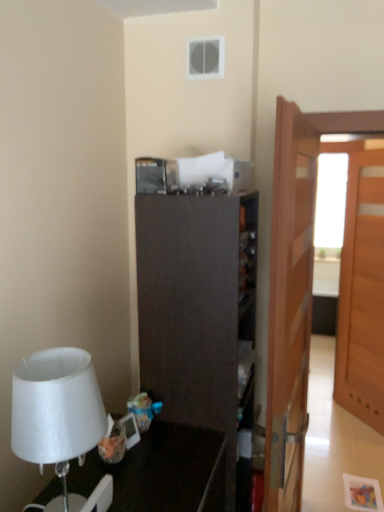
Question: Is dark wood cabinet at center to the right of light brown wooden door at right, which is counted as the first door, starting from the back, from the viewer's perspective?

Choices:
 (A) yes
 (B) no

Answer: (B)

Question: Is dark wood cabinet at center far from light brown wooden door at right, the 2th door in the left-to-right sequence?

Choices:
 (A) yes
 (B) no

Answer: (A)

Question: From a real-world perspective, is dark wood cabinet at center physically above light brown wooden door at right, which is counted as the first door, starting from the back?

Choices:
 (A) yes
 (B) no

Answer: (B)

Question: From the image's perspective, is dark wood cabinet at center below light brown wooden door at right, which is counted as the first door, starting from the back?

Choices:
 (A) no
 (B) yes

Answer: (B)

Question: Does dark wood cabinet at center have a larger size compared to light brown wooden door at right, which is counted as the first door, starting from the back?

Choices:
 (A) yes
 (B) no

Answer: (A)

Question: Does dark wood cabinet at center have a smaller size compared to light brown wooden door at right, the second door positioned from the front?

Choices:
 (A) yes
 (B) no

Answer: (B)

Question: From the image's perspective, would you say light brown wooden door at right, which is counted as the first door, starting from the back, is shown under dark wood cabinet at center?

Choices:
 (A) no
 (B) yes

Answer: (A)

Question: Is dark wood cabinet at center completely or partially inside light brown wooden door at right, which is counted as the first door, starting from the back?

Choices:
 (A) no
 (B) yes

Answer: (A)

Question: Is light brown wooden door at right, arranged as the 1th door when viewed from the right, thinner than dark wood cabinet at center?

Choices:
 (A) no
 (B) yes

Answer: (B)

Question: Can you confirm if light brown wooden door at right, the 2th door in the left-to-right sequence, is taller than dark wood cabinet at center?

Choices:
 (A) yes
 (B) no

Answer: (A)

Question: Considering the relative positions of light brown wooden door at right, which is counted as the first door, starting from the back, and dark wood cabinet at center in the image provided, is light brown wooden door at right, which is counted as the first door, starting from the back, behind dark wood cabinet at center?

Choices:
 (A) no
 (B) yes

Answer: (B)

Question: Can you confirm if light brown wooden door at right, the 2th door in the left-to-right sequence, is wider than dark wood cabinet at center?

Choices:
 (A) yes
 (B) no

Answer: (B)

Question: From a real-world perspective, is dark wood cabinet at center beneath white matte lampshade at left?

Choices:
 (A) yes
 (B) no

Answer: (A)